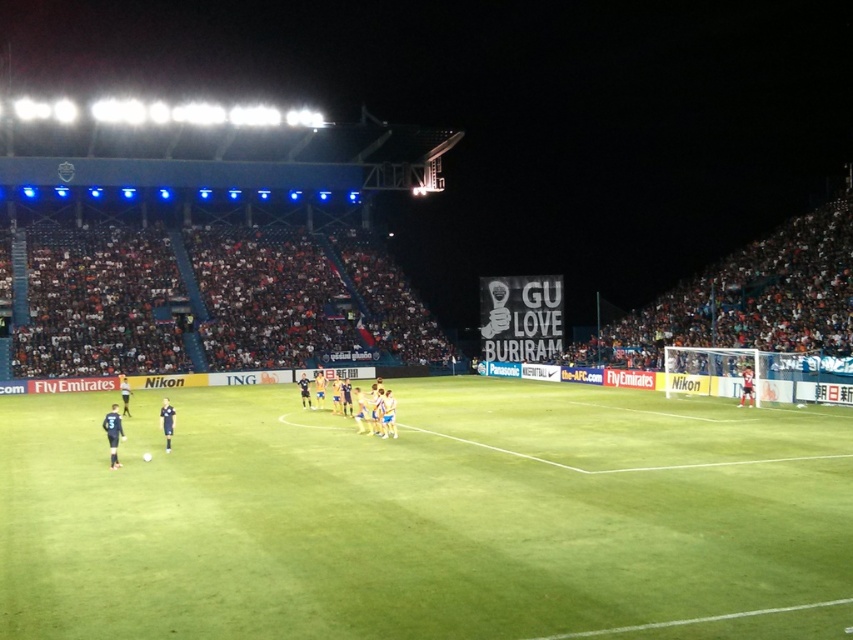
Question: Is green grass football field at center further to the viewer compared to blue fabric jersey at center?

Choices:
 (A) no
 (B) yes

Answer: (A)

Question: Which point is farther from the camera taking this photo?

Choices:
 (A) (346, 403)
 (B) (35, 582)

Answer: (A)

Question: Where is green grass football field at center located in relation to blue fabric jersey at center in the image?

Choices:
 (A) below
 (B) above

Answer: (A)

Question: Which point appears closest to the camera in this image?

Choices:
 (A) (364, 401)
 (B) (177, 625)

Answer: (B)

Question: Can you confirm if green grass football field at center is positioned below blue fabric jersey at center?

Choices:
 (A) yes
 (B) no

Answer: (A)

Question: Among these objects, which one is nearest to the camera?

Choices:
 (A) blue fabric jersey at center
 (B) green grass football field at center

Answer: (B)